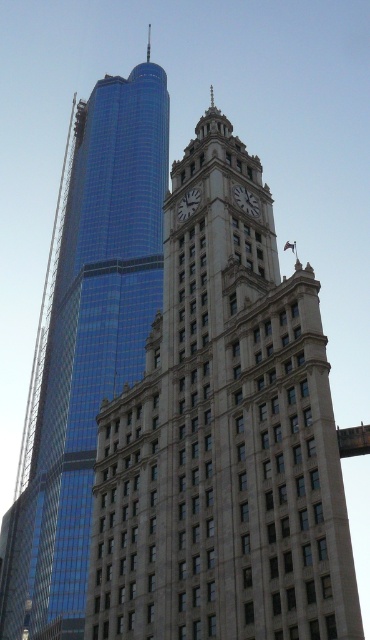
Which is behind, point (233, 188) or point (179, 209)?

The point (179, 209) is behind.

Can you confirm if silver metallic clock at upper center is positioned below silver metallic clock at center?

Indeed, silver metallic clock at upper center is positioned under silver metallic clock at center.

Who is more distant from viewer, (241, 193) or (189, 204)?

Positioned behind is point (241, 193).

This screenshot has width=370, height=640. Find the location of `silver metallic clock at upper center`. silver metallic clock at upper center is located at coordinates (246, 200).

Does beige stone clock tower at center appear on the right side of silver metallic clock at center?

Correct, you'll find beige stone clock tower at center to the right of silver metallic clock at center.

Is beige stone clock tower at center smaller than silver metallic clock at center?

Incorrect, beige stone clock tower at center is not smaller in size than silver metallic clock at center.

Is point (169, 461) positioned after point (190, 211)?

No, it is in front of (190, 211).

You are a GUI agent. You are given a task and a screenshot of the screen. Output one action in this format:
    pyautogui.click(x=<x>, y=<y>)
    Task: Click on the beige stone clock tower at center
    Image resolution: width=370 pixels, height=640 pixels.
    Given the screenshot: What is the action you would take?
    (x=223, y=436)

Which is behind, point (52, 374) or point (247, 204)?

The point (52, 374) is more distant.

Which is above, shiny glass skyscraper at left or silver metallic clock at upper center?

shiny glass skyscraper at left

Locate an element on the screen. This screenshot has width=370, height=640. shiny glass skyscraper at left is located at coordinates (89, 346).